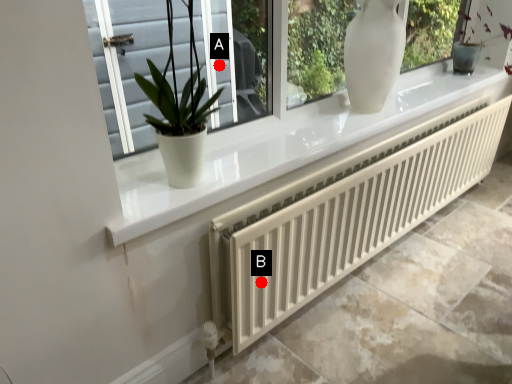
Question: Two points are circled on the image, labeled by A and B beside each circle. Which point is closer to the camera taking this photo?

Choices:
 (A) A is closer
 (B) B is closer

Answer: (B)